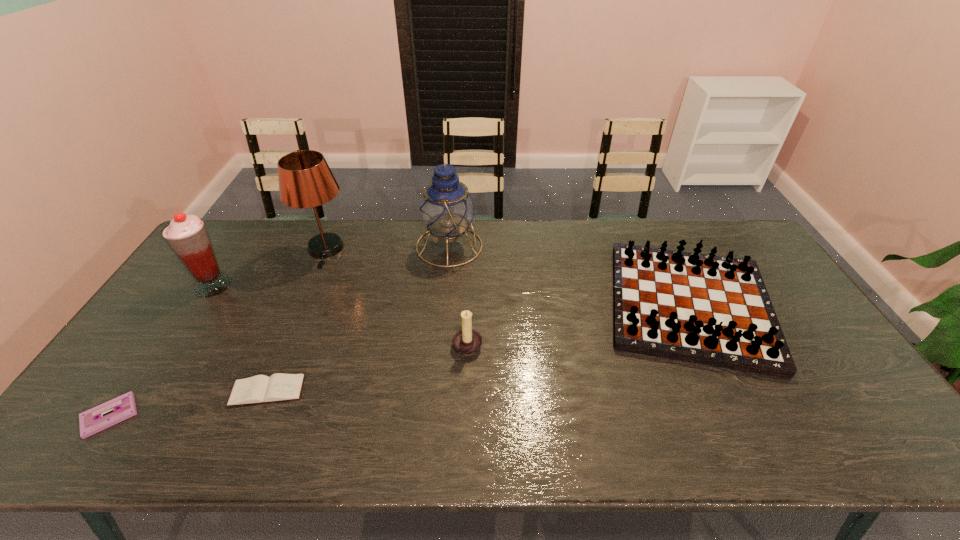
Choose which object is the sixth nearest neighbor to the lantern. Please provide its 2D coordinates. Your answer should be formatted as a tuple, i.e. [(x, y)], where the tuple contains the x and y coordinates of a point satisfying the conditions above.

[(91, 421)]

This screenshot has width=960, height=540. Identify the location of vacant region that satisfies the following two spatial constraints: 1. on the front-facing side of the lantern; 2. on the front-facing side of the lampshade. (449, 249).

The height and width of the screenshot is (540, 960). What are the coordinates of `vacant point that satisfies the following two spatial constraints: 1. on the front-facing side of the lampshade; 2. on the left side of the rightmost object` in the screenshot? It's located at (302, 305).

I want to click on free region that satisfies the following two spatial constraints: 1. on the front-facing side of the lantern; 2. on the back side of the rightmost object, so click(x=444, y=305).

In order to click on vacant space that satisfies the following two spatial constraints: 1. on the front-facing side of the lantern; 2. on the front side of the smoothie in this screenshot , I will do `click(446, 285)`.